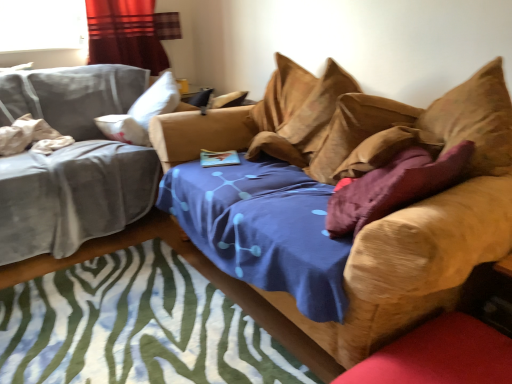
What is the approximate height of velvet purple pillow at center, which is the second pillow in right-to-left order?

15.09 inches.

In order to face velvet purple pillow at center, marked as the third pillow in a left-to-right arrangement, should I rotate leftwards or rightwards?

A 13.194 degree turn to the right will do.

You are a GUI agent. You are given a task and a screenshot of the screen. Output one action in this format:
    pyautogui.click(x=<x>, y=<y>)
    Task: Click on the velvet brown couch at center, the 1th studio couch viewed from the right
    
    Given the screenshot: What is the action you would take?
    pyautogui.click(x=416, y=211)

You are a GUI agent. You are given a task and a screenshot of the screen. Output one action in this format:
    pyautogui.click(x=<x>, y=<y>)
    Task: Click on the suede-like brown pillow at upper right, arranged as the 4th pillow when viewed from the left
    This screenshot has width=512, height=384.
    Given the screenshot: What is the action you would take?
    pyautogui.click(x=475, y=120)

This screenshot has height=384, width=512. Describe the element at coordinates (31, 137) in the screenshot. I see `white cotton pillow at left, which is the 1th pillow from left to right` at that location.

Identify the location of velvet gray studio couch at left, which is the second studio couch from right to left. pyautogui.click(x=72, y=162).

Locate an element on the screen. This screenshot has height=384, width=512. suede-like tan pillow at upper center, marked as the third pillow in a right-to-left arrangement is located at coordinates (297, 110).

Is velvet brown couch at center, which is the 2th studio couch from left to right, in contact with suede-like tan pillow at upper center, marked as the third pillow in a right-to-left arrangement?

velvet brown couch at center, which is the 2th studio couch from left to right, is not next to suede-like tan pillow at upper center, marked as the third pillow in a right-to-left arrangement, and they're not touching.

Which is in front, point (328, 344) or point (288, 119)?

The point (328, 344) is more forward.

Can we say velvet brown couch at center, which is the 2th studio couch from left to right, lies outside suede-like tan pillow at upper center, which appears as the second pillow when viewed from the left?

Indeed, velvet brown couch at center, which is the 2th studio couch from left to right, is completely outside suede-like tan pillow at upper center, which appears as the second pillow when viewed from the left.

Considering the relative positions of velvet brown couch at center, the 1th studio couch viewed from the right, and suede-like tan pillow at upper center, marked as the third pillow in a right-to-left arrangement, in the image provided, is velvet brown couch at center, the 1th studio couch viewed from the right, to the left or to the right of suede-like tan pillow at upper center, marked as the third pillow in a right-to-left arrangement,?

velvet brown couch at center, the 1th studio couch viewed from the right, is positioned on suede-like tan pillow at upper center, marked as the third pillow in a right-to-left arrangement,'s right side.

Considering the relative positions of suede-like brown pillow at upper right, arranged as the 4th pillow when viewed from the left, and zebra-patterned rug at center in the image provided, is suede-like brown pillow at upper right, arranged as the 4th pillow when viewed from the left, to the left of zebra-patterned rug at center from the viewer's perspective?

No.

Between suede-like brown pillow at upper right, acting as the 1th pillow starting from the right, and zebra-patterned rug at center, which one has more height?

With more height is suede-like brown pillow at upper right, acting as the 1th pillow starting from the right.

Which of these two, suede-like brown pillow at upper right, arranged as the 4th pillow when viewed from the left, or zebra-patterned rug at center, is bigger?

With larger size is suede-like brown pillow at upper right, arranged as the 4th pillow when viewed from the left.

From the image's perspective, would you say suede-like brown pillow at upper right, arranged as the 4th pillow when viewed from the left, is shown under zebra-patterned rug at center?

Incorrect, from the image's perspective, suede-like brown pillow at upper right, arranged as the 4th pillow when viewed from the left, is higher than zebra-patterned rug at center.

Does velvet curtain at upper left have a greater width compared to white cotton pillow at left, placed as the fourth pillow when sorted from right to left?

In fact, velvet curtain at upper left might be narrower than white cotton pillow at left, placed as the fourth pillow when sorted from right to left.

Does point (105, 41) lie in front of point (27, 138)?

That is False.

From the image's perspective, between velvet curtain at upper left and white cotton pillow at left, placed as the fourth pillow when sorted from right to left, who is located below?

white cotton pillow at left, placed as the fourth pillow when sorted from right to left.

Which is more to the right, velvet curtain at upper left or white cotton pillow at left, placed as the fourth pillow when sorted from right to left?

velvet curtain at upper left is more to the right.

Is suede-like brown pillow at upper right, arranged as the 4th pillow when viewed from the left, outside of suede-like tan pillow at upper center, which appears as the second pillow when viewed from the left?

That's correct, suede-like brown pillow at upper right, arranged as the 4th pillow when viewed from the left, is outside of suede-like tan pillow at upper center, which appears as the second pillow when viewed from the left.

Consider the image. Is suede-like brown pillow at upper right, arranged as the 4th pillow when viewed from the left, next to suede-like tan pillow at upper center, marked as the third pillow in a right-to-left arrangement, and touching it?

suede-like brown pillow at upper right, arranged as the 4th pillow when viewed from the left, and suede-like tan pillow at upper center, marked as the third pillow in a right-to-left arrangement, are not in contact.

Which object is further away from the camera taking this photo, suede-like brown pillow at upper right, acting as the 1th pillow starting from the right, or suede-like tan pillow at upper center, which appears as the second pillow when viewed from the left?

suede-like tan pillow at upper center, which appears as the second pillow when viewed from the left, is behind.

Is suede-like brown pillow at upper right, arranged as the 4th pillow when viewed from the left, wider or thinner than suede-like tan pillow at upper center, marked as the third pillow in a right-to-left arrangement?

suede-like brown pillow at upper right, arranged as the 4th pillow when viewed from the left, is wider than suede-like tan pillow at upper center, marked as the third pillow in a right-to-left arrangement.

Is velvet purple pillow at center, which is the second pillow in right-to-left order, looking in the opposite direction of velvet gray studio couch at left, the 1th studio couch viewed from the left?

No, velvet purple pillow at center, which is the second pillow in right-to-left order, is not facing away from velvet gray studio couch at left, the 1th studio couch viewed from the left.

From the image's perspective, is velvet purple pillow at center, marked as the third pillow in a left-to-right arrangement, located above or below velvet gray studio couch at left, the 1th studio couch viewed from the left?

velvet purple pillow at center, marked as the third pillow in a left-to-right arrangement, is situated lower than velvet gray studio couch at left, the 1th studio couch viewed from the left, in the image.

Considering the relative sizes of velvet purple pillow at center, which is the second pillow in right-to-left order, and velvet gray studio couch at left, which is the second studio couch from right to left, in the image provided, is velvet purple pillow at center, which is the second pillow in right-to-left order, smaller than velvet gray studio couch at left, which is the second studio couch from right to left,?

Yes, velvet purple pillow at center, which is the second pillow in right-to-left order, is smaller than velvet gray studio couch at left, which is the second studio couch from right to left.

From a real-world perspective, is velvet purple pillow at center, marked as the third pillow in a left-to-right arrangement, beneath suede-like brown pillow at upper right, acting as the 1th pillow starting from the right?

Yes.

Between velvet purple pillow at center, marked as the third pillow in a left-to-right arrangement, and suede-like brown pillow at upper right, acting as the 1th pillow starting from the right, which one appears on the left side from the viewer's perspective?

From the viewer's perspective, velvet purple pillow at center, marked as the third pillow in a left-to-right arrangement, appears more on the left side.

Looking at their sizes, would you say velvet purple pillow at center, marked as the third pillow in a left-to-right arrangement, is wider or thinner than suede-like brown pillow at upper right, arranged as the 4th pillow when viewed from the left?

Clearly, velvet purple pillow at center, marked as the third pillow in a left-to-right arrangement, has more width compared to suede-like brown pillow at upper right, arranged as the 4th pillow when viewed from the left.

Is zebra-patterned rug at center looking in the opposite direction of suede-like brown pillow at upper right, acting as the 1th pillow starting from the right?

No, zebra-patterned rug at center's orientation is not away from suede-like brown pillow at upper right, acting as the 1th pillow starting from the right.

Considering the positions of objects zebra-patterned rug at center and suede-like brown pillow at upper right, acting as the 1th pillow starting from the right, in the image provided, who is more to the left, zebra-patterned rug at center or suede-like brown pillow at upper right, acting as the 1th pillow starting from the right,?

zebra-patterned rug at center.

Considering the positions of point (110, 379) and point (484, 76), is point (110, 379) closer or farther from the camera than point (484, 76)?

Point (110, 379).

Is suede-like brown pillow at upper right, acting as the 1th pillow starting from the right, a part of zebra-patterned rug at center?

Actually, suede-like brown pillow at upper right, acting as the 1th pillow starting from the right, is outside zebra-patterned rug at center.

Which studio couch is the 2nd one when counting from the front of the suede-like tan pillow at upper center, which appears as the second pillow when viewed from the left? Please provide its 2D coordinates.

[(416, 211)]

Identify the location of the 4th pillow above the zebra-patterned rug at center (from a real-world perspective). (475, 120).

In the scene shown: Based on their spatial positions, is white cotton pillow at left, placed as the fourth pillow when sorted from right to left, or velvet curtain at upper left further from zebra-patterned rug at center?

The object further to zebra-patterned rug at center is velvet curtain at upper left.

Considering their positions, is white cotton pillow at left, placed as the fourth pillow when sorted from right to left, positioned further to velvet brown couch at center, the 1th studio couch viewed from the right, than zebra-patterned rug at center?

Based on the image, white cotton pillow at left, placed as the fourth pillow when sorted from right to left, appears to be further to velvet brown couch at center, the 1th studio couch viewed from the right.

Considering their positions, is suede-like brown pillow at upper right, acting as the 1th pillow starting from the right, positioned further to suede-like tan pillow at upper center, which appears as the second pillow when viewed from the left, than velvet gray studio couch at left, the 1th studio couch viewed from the left?

velvet gray studio couch at left, the 1th studio couch viewed from the left, is further to suede-like tan pillow at upper center, which appears as the second pillow when viewed from the left.

Estimate the real-world distances between objects in this image. Which object is further from suede-like tan pillow at upper center, which appears as the second pillow when viewed from the left, white cotton pillow at left, which is the 1th pillow from left to right, or suede-like brown pillow at upper right, acting as the 1th pillow starting from the right?

white cotton pillow at left, which is the 1th pillow from left to right.

Looking at this image, based on their spatial positions, is velvet purple pillow at center, marked as the third pillow in a left-to-right arrangement, or velvet curtain at upper left further from suede-like tan pillow at upper center, marked as the third pillow in a right-to-left arrangement?

velvet curtain at upper left is further to suede-like tan pillow at upper center, marked as the third pillow in a right-to-left arrangement.

Considering their positions, is velvet gray studio couch at left, which is the second studio couch from right to left, positioned closer to zebra-patterned rug at center than velvet brown couch at center, which is the 2th studio couch from left to right?

velvet brown couch at center, which is the 2th studio couch from left to right, is closer to zebra-patterned rug at center.

Considering their positions, is white cotton pillow at left, placed as the fourth pillow when sorted from right to left, positioned closer to zebra-patterned rug at center than suede-like tan pillow at upper center, which appears as the second pillow when viewed from the left?

suede-like tan pillow at upper center, which appears as the second pillow when viewed from the left, is closer to zebra-patterned rug at center.

Which object lies further to the anchor point velvet gray studio couch at left, which is the second studio couch from right to left, velvet brown couch at center, which is the 2th studio couch from left to right, or suede-like brown pillow at upper right, arranged as the 4th pillow when viewed from the left?

The object further to velvet gray studio couch at left, which is the second studio couch from right to left, is suede-like brown pillow at upper right, arranged as the 4th pillow when viewed from the left.

The height and width of the screenshot is (384, 512). Find the location of `curtain located between white cotton pillow at left, which is the 1th pillow from left to right, and suede-like brown pillow at upper right, arranged as the 4th pillow when viewed from the left, in the left-right direction`. curtain located between white cotton pillow at left, which is the 1th pillow from left to right, and suede-like brown pillow at upper right, arranged as the 4th pillow when viewed from the left, in the left-right direction is located at coordinates (124, 34).

At what (x,y) coordinates should I click in order to perform the action: click on curtain situated between velvet gray studio couch at left, which is the second studio couch from right to left, and suede-like tan pillow at upper center, marked as the third pillow in a right-to-left arrangement, from left to right. Please return your answer as a coordinate pair (x, y). The height and width of the screenshot is (384, 512). Looking at the image, I should click on (124, 34).

Where is `mat between velvet gray studio couch at left, which is the second studio couch from right to left, and velvet purple pillow at center, marked as the third pillow in a left-to-right arrangement`? mat between velvet gray studio couch at left, which is the second studio couch from right to left, and velvet purple pillow at center, marked as the third pillow in a left-to-right arrangement is located at coordinates (135, 327).

Locate an element on the screen. This screenshot has width=512, height=384. pillow situated between white cotton pillow at left, which is the 1th pillow from left to right, and velvet brown couch at center, which is the 2th studio couch from left to right, from left to right is located at coordinates (297, 110).